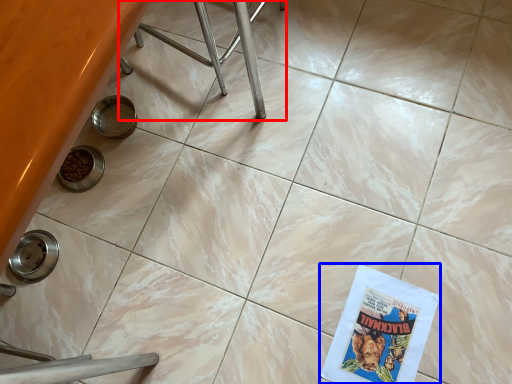
Question: Which object is further to the camera taking this photo, furniture (highlighted by a red box) or comic book (highlighted by a blue box)?

Choices:
 (A) furniture
 (B) comic book

Answer: (B)